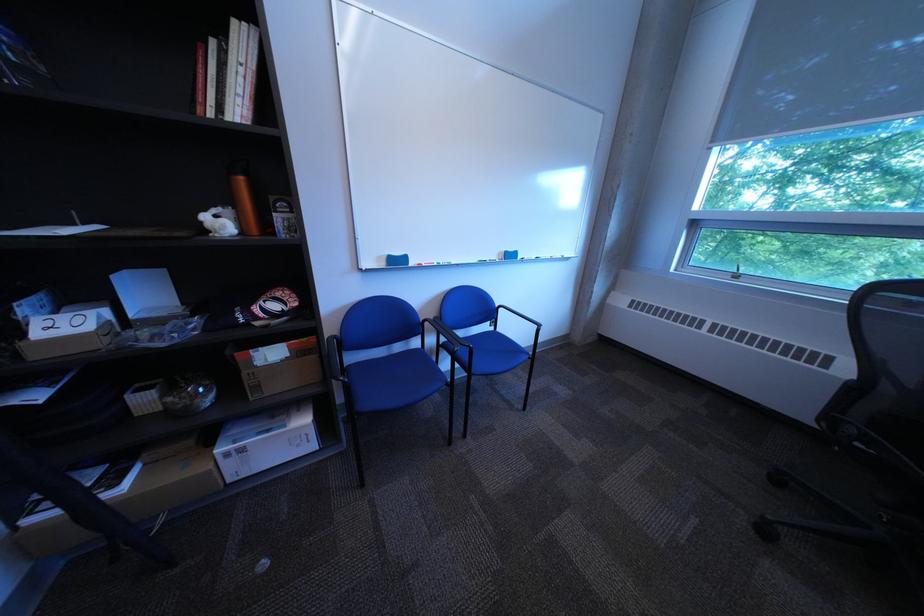
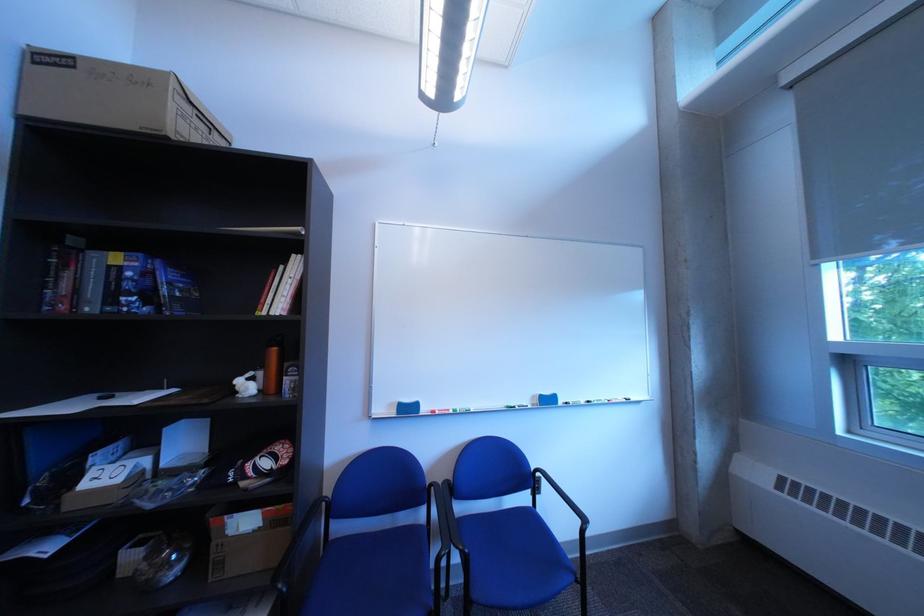
The point at (x=227, y=44) is marked in the first image. Where is the corresponding point in the second image?

(297, 270)